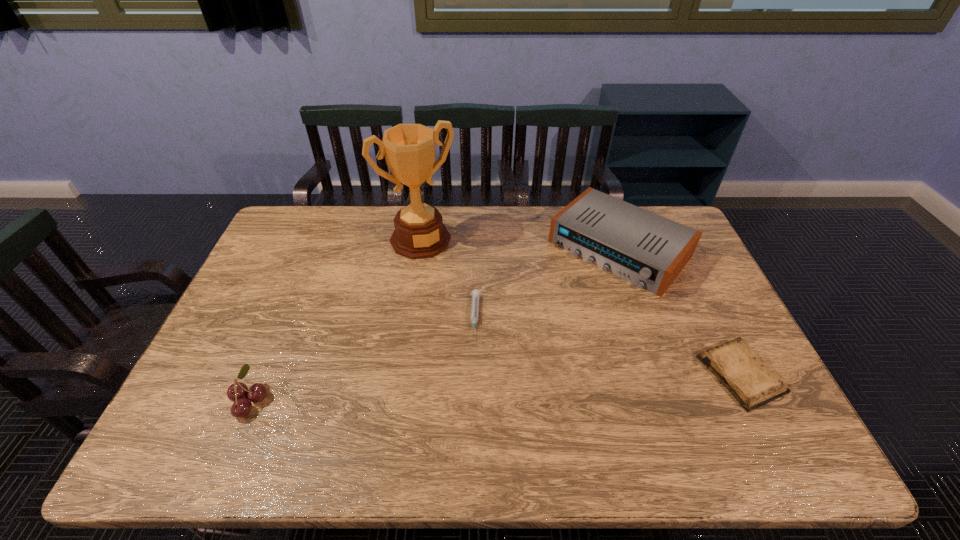
Locate an element on the screen. cherry located in the near edge section of the desktop is located at coordinates 237,392.

I want to click on diary located at the near edge, so click(737, 366).

At what (x,y) coordinates should I click in order to perform the action: click on object present at the left edge. Please return your answer as a coordinate pair (x, y). Looking at the image, I should click on [x=237, y=392].

Locate an element on the screen. The width and height of the screenshot is (960, 540). diary present at the right edge is located at coordinates (737, 366).

At what (x,y) coordinates should I click in order to perform the action: click on radio receiver that is at the right edge. Please return your answer as a coordinate pair (x, y). Looking at the image, I should click on (644, 248).

The image size is (960, 540). What are the coordinates of `object present at the near left corner` in the screenshot? It's located at (237, 392).

You are a GUI agent. You are given a task and a screenshot of the screen. Output one action in this format:
    pyautogui.click(x=<x>, y=<y>)
    Task: Click on the object present at the far right corner
    The image size is (960, 540).
    Given the screenshot: What is the action you would take?
    pyautogui.click(x=644, y=248)

Locate an element on the screen. object at the near right corner is located at coordinates (737, 366).

Locate an element on the screen. This screenshot has height=540, width=960. vacant space at the far edge of the desktop is located at coordinates (348, 235).

Locate an element on the screen. The image size is (960, 540). vacant region at the near edge is located at coordinates (444, 411).